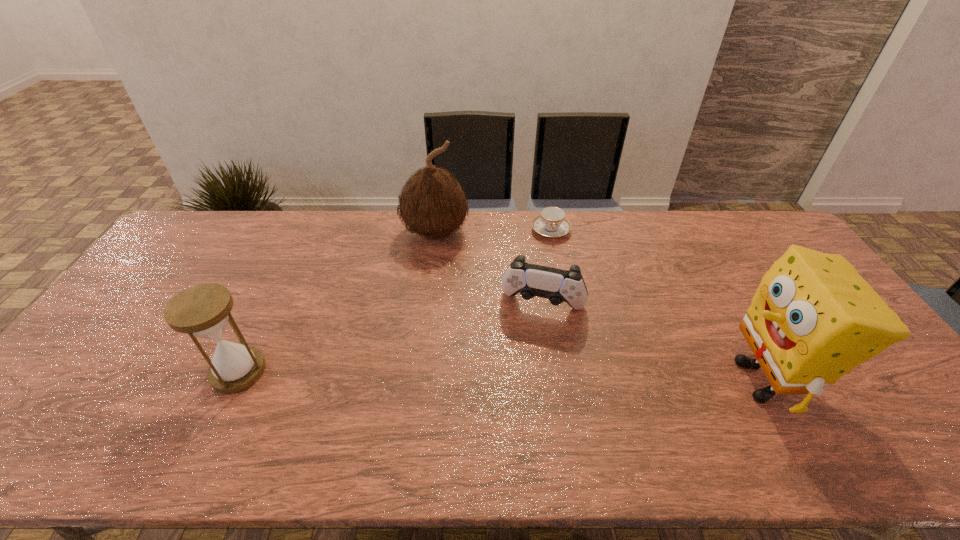
This screenshot has height=540, width=960. Identify the location of coconut positioned at the far edge. (433, 204).

Where is `teacup that is at the far edge`? Image resolution: width=960 pixels, height=540 pixels. teacup that is at the far edge is located at coordinates (551, 223).

Where is `hourglass that is at the near edge`? This screenshot has width=960, height=540. hourglass that is at the near edge is located at coordinates (203, 310).

Locate an element on the screen. This screenshot has width=960, height=540. sponge that is at the near edge is located at coordinates (813, 318).

Where is `free region at the far edge of the desktop`? free region at the far edge of the desktop is located at coordinates (447, 250).

This screenshot has height=540, width=960. In order to click on free space at the near edge of the desktop in this screenshot , I will do tap(511, 414).

The height and width of the screenshot is (540, 960). In the image, there is a desktop. In order to click on blank space at the left edge in this screenshot , I will do `click(112, 381)`.

In the image, there is a desktop. Where is `blank space at the near left corner`? This screenshot has height=540, width=960. blank space at the near left corner is located at coordinates (102, 395).

Find the location of a particular element. The height and width of the screenshot is (540, 960). free region at the near right corner is located at coordinates (878, 409).

Where is `free space between the hourglass and the coconut`? The image size is (960, 540). free space between the hourglass and the coconut is located at coordinates (337, 302).